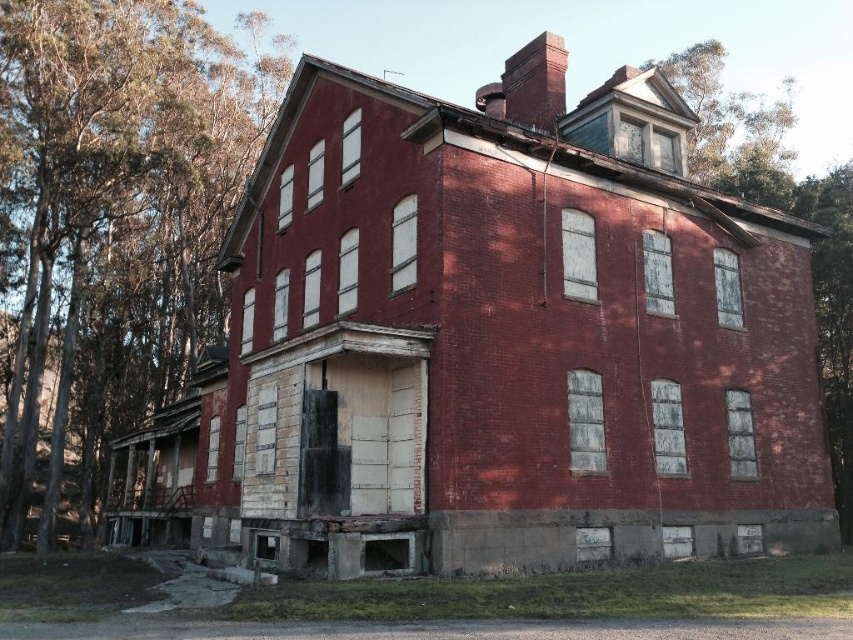
You are standing in front of the old brick building and notice two points marked on its facade. The first point is at coordinates point (x=186, y=330) and the second is at point (x=816, y=364). Which point is closer to you?

Point (x=186, y=330) is closer to you because it is further to the camera than point (x=816, y=364).

You are standing in front of the old brick building and notice two trees. One is the green leafy tree at left and the other is the smooth bark tree at upper right. Which tree is positioned more to the left side of the building?

The green leafy tree at left is positioned more to the left side of the building than the smooth bark tree at upper right.